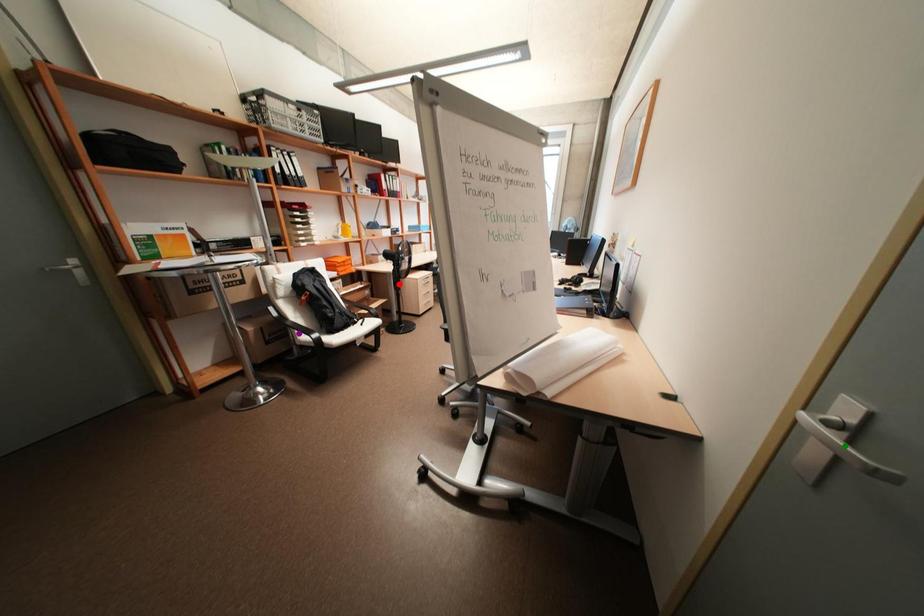
Order these from farthest to nearest:
- green point
- red point
- purple point

red point, purple point, green point